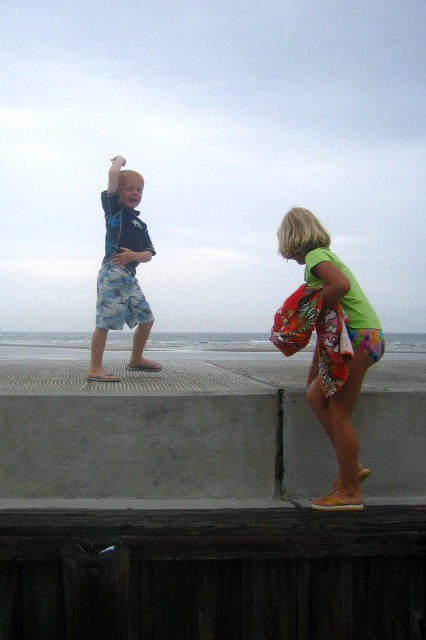
You are a parent trying to ensure your children are safe while playing on the gray concrete at lower center. The blue camouflage shorts at left belong to your son. If you want to keep him within 40 inches of you, can he stay where he is?

The gray concrete at lower center is 38.83 inches from blue camouflage shorts at left. Since 38.83 inches is less than 40 inches, your son can safely stay where he is.